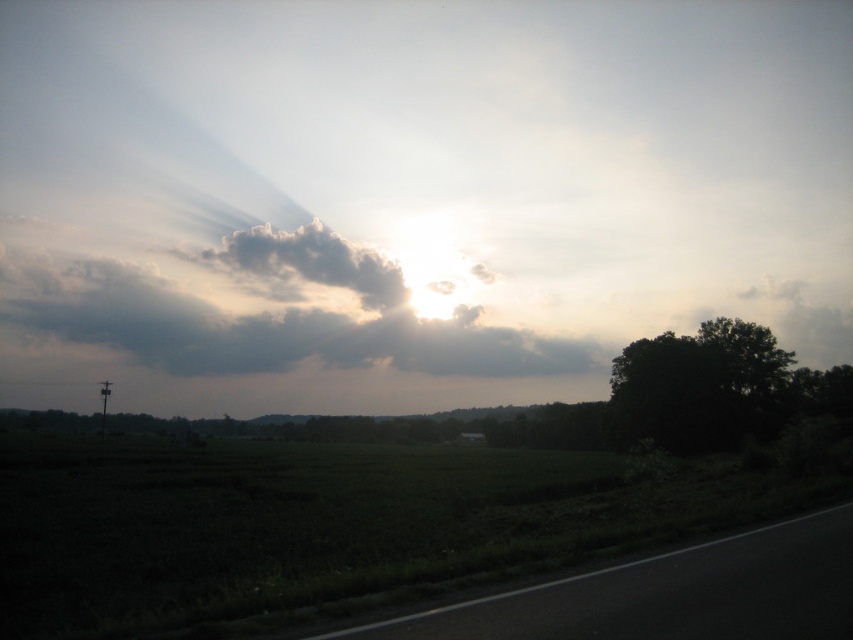
Question: Considering the real-world distances, which object is farthest from the black asphalt highway at lower right?

Choices:
 (A) dark green leafy tree at right
 (B) dark gray cloud at upper center
 (C) cloudy gray at upper center

Answer: (B)

Question: Is dark gray cloud at upper center bigger than black asphalt highway at lower right?

Choices:
 (A) yes
 (B) no

Answer: (A)

Question: Based on their relative distances, which object is nearer to the dark green leafy tree at right?

Choices:
 (A) cloudy gray at upper center
 (B) dark gray cloud at upper center

Answer: (B)

Question: Which point is closer to the camera?

Choices:
 (A) dark gray cloud at upper center
 (B) black asphalt highway at lower right
 (C) cloudy gray at upper center
 (D) dark green leafy tree at right

Answer: (B)

Question: Is black asphalt highway at lower right thinner than dark green leafy tree at right?

Choices:
 (A) no
 (B) yes

Answer: (B)

Question: Can you confirm if dark gray cloud at upper center is positioned to the right of dark green leafy tree at right?

Choices:
 (A) yes
 (B) no

Answer: (B)